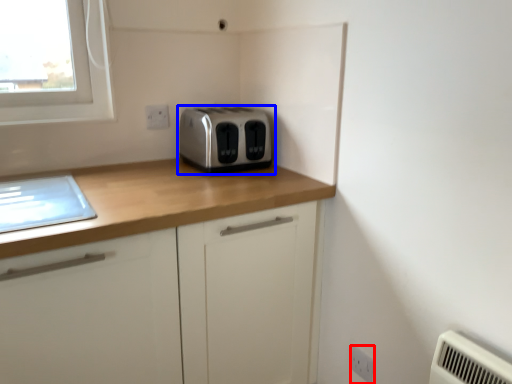
Question: Among these objects, which one is farthest to the camera, electric outlet (highlighted by a red box) or toaster (highlighted by a blue box)?

Choices:
 (A) electric outlet
 (B) toaster

Answer: (B)